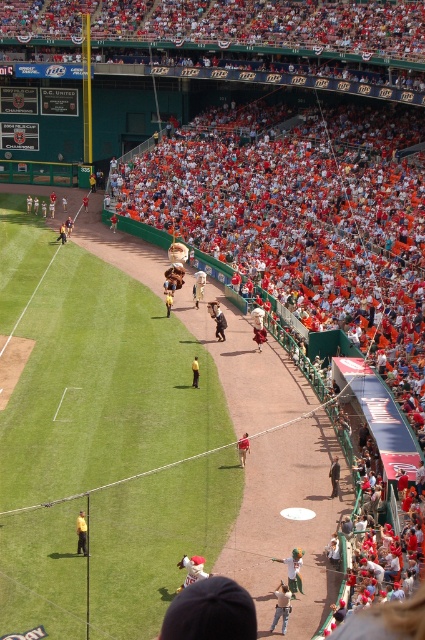
You are a photographer standing at the edge of the baseball field. You notice two items in your viewfinder, the tan leather jacket at lower center and the white fabric at center. Which item appears wider in your photo?

The white fabric at center appears wider because its width is greater than the tan leather jacket at lower center.

You are a photographer standing at the center of the baseball stadium. You want to take a photo of two points in the image, point 1 at coordinates point (286, 608) and point 2 at coordinates point (85, 524). Which point will appear larger in your photo?

Point 1 at coordinates point (286, 608) will appear larger in the photo because it is closer to the camera than point 2 at coordinates point (85, 524).